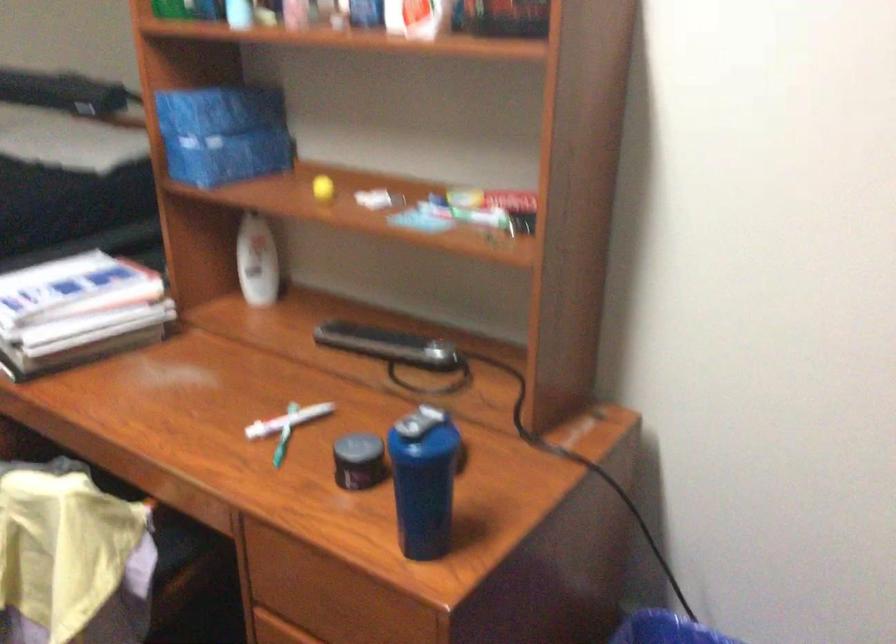
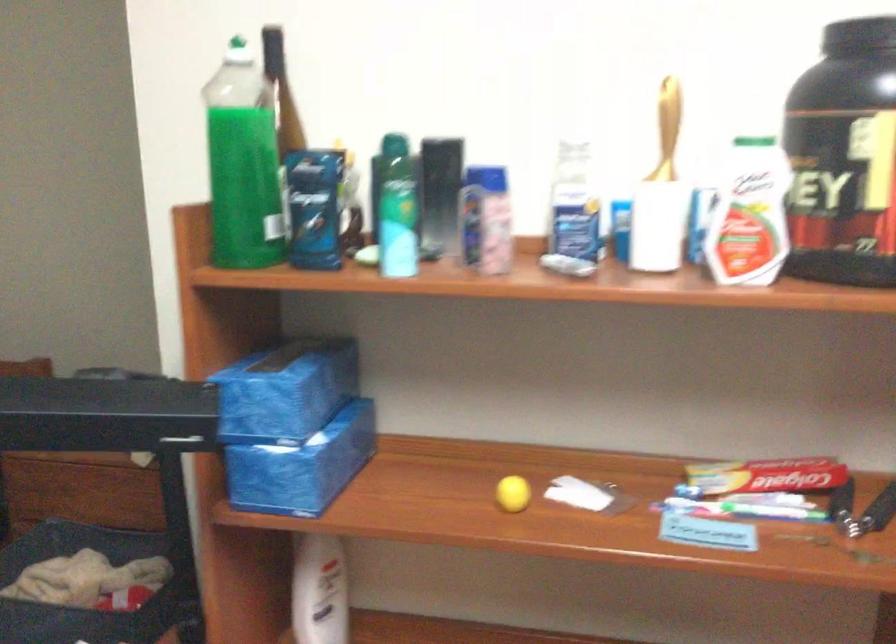
In the second image, find the point that corresponds to the point at 250,254 in the first image.

(319, 591)